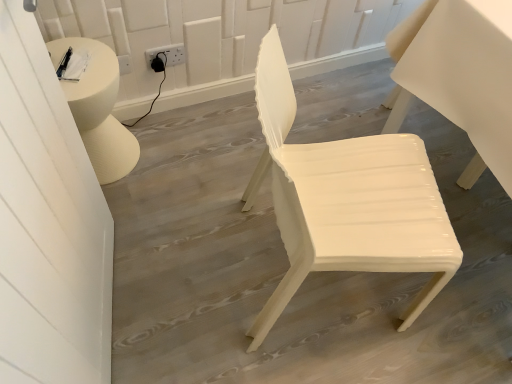
Question: Is glossy white chair at center aimed at white plastic outlet at upper center?

Choices:
 (A) no
 (B) yes

Answer: (A)

Question: Is glossy white chair at center looking in the opposite direction of white plastic outlet at upper center?

Choices:
 (A) yes
 (B) no

Answer: (B)

Question: Can you confirm if glossy white chair at center is wider than white plastic outlet at upper center?

Choices:
 (A) yes
 (B) no

Answer: (A)

Question: Is glossy white chair at center at the left side of white plastic outlet at upper center?

Choices:
 (A) yes
 (B) no

Answer: (B)

Question: Does glossy white chair at center have a greater height compared to white plastic outlet at upper center?

Choices:
 (A) yes
 (B) no

Answer: (A)

Question: Does glossy white chair at center have a lesser height compared to white plastic outlet at upper center?

Choices:
 (A) no
 (B) yes

Answer: (A)

Question: Does white plastic outlet at upper center have a lesser width compared to glossy white chair at center?

Choices:
 (A) yes
 (B) no

Answer: (A)

Question: From the image's perspective, is white plastic outlet at upper center under glossy white chair at center?

Choices:
 (A) no
 (B) yes

Answer: (A)

Question: Is white plastic outlet at upper center outside of glossy white chair at center?

Choices:
 (A) yes
 (B) no

Answer: (A)

Question: Is white plastic outlet at upper center with glossy white chair at center?

Choices:
 (A) no
 (B) yes

Answer: (A)

Question: From a real-world perspective, is white plastic outlet at upper center over glossy white chair at center?

Choices:
 (A) yes
 (B) no

Answer: (B)

Question: Is white plastic outlet at upper center far away from glossy white chair at center?

Choices:
 (A) yes
 (B) no

Answer: (B)

Question: From a real-world perspective, is white plastic outlet at upper center physically located above or below glossy white chair at center?

Choices:
 (A) below
 (B) above

Answer: (A)